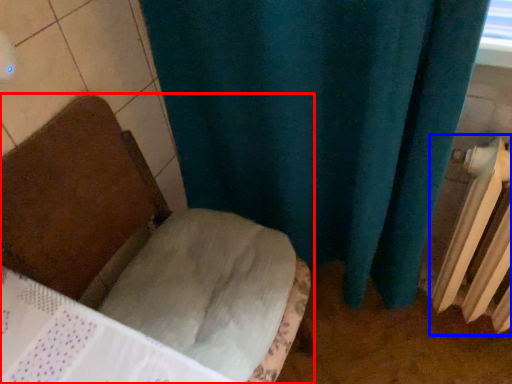
Question: Among these objects, which one is farthest to the camera, furniture (highlighted by a red box) or radiator (highlighted by a blue box)?

Choices:
 (A) furniture
 (B) radiator

Answer: (B)